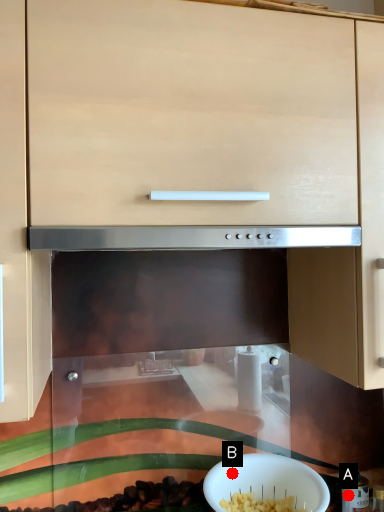
Question: Two points are circled on the image, labeled by A and B beside each circle. Among these points, which one is farthest from the camera?

Choices:
 (A) A is further
 (B) B is further

Answer: (A)